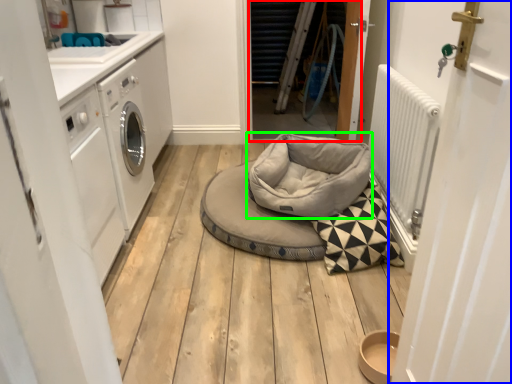
Question: Which object is the closest to the door (highlighted by a red box)? Choose among these: door (highlighted by a blue box) or dog bed (highlighted by a green box).

Choices:
 (A) door
 (B) dog bed

Answer: (B)